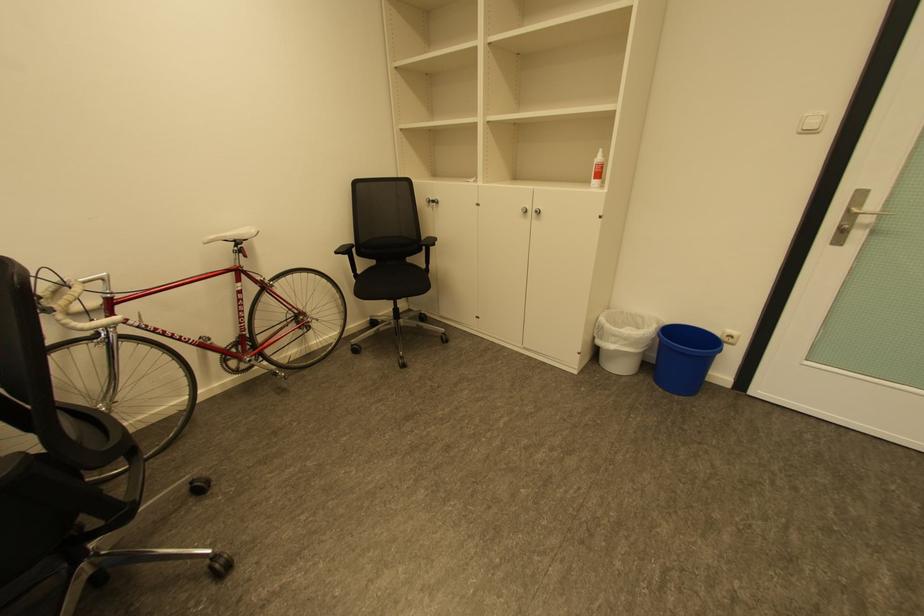
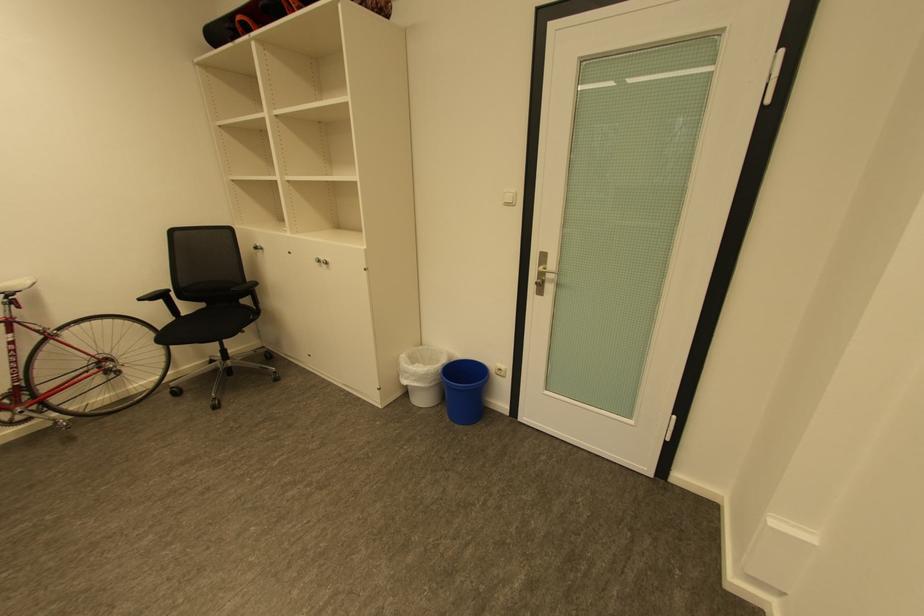
The point at (x=344, y=253) is marked in the first image. Where is the corresponding point in the second image?

(148, 300)